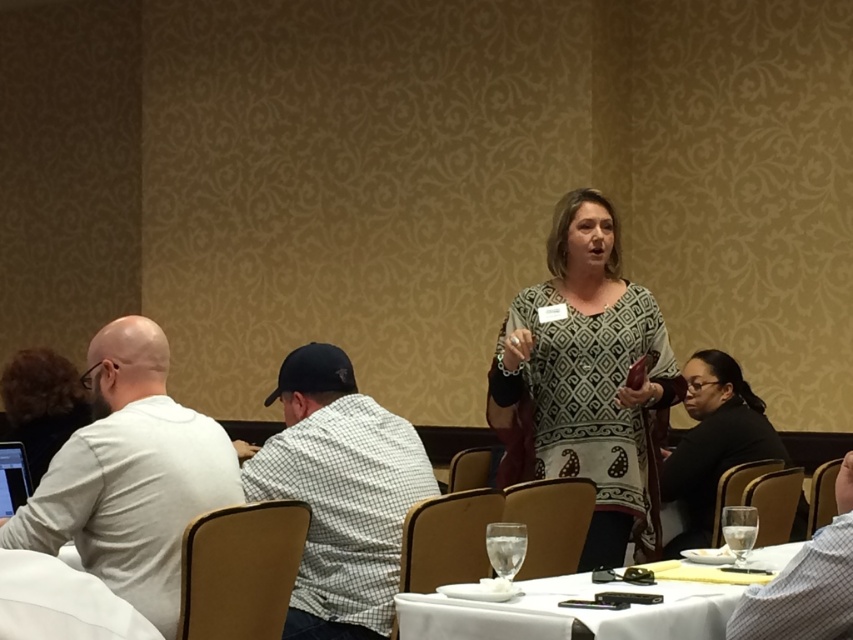
Who is positioned more to the right, patterned fabric shirt at center or clear glass at table right?

From the viewer's perspective, clear glass at table right appears more on the right side.

Who is higher up, patterned fabric shirt at center or clear glass at table right?

patterned fabric shirt at center is higher up.

The height and width of the screenshot is (640, 853). Find the location of `patterned fabric shirt at center`. patterned fabric shirt at center is located at coordinates (585, 381).

Does white cloth table at center appear under matte black shirt at center?

Yes, white cloth table at center is below matte black shirt at center.

Is white cloth table at center bigger than matte black shirt at center?

No.

The image size is (853, 640). Describe the element at coordinates (572, 612) in the screenshot. I see `white cloth table at center` at that location.

Image resolution: width=853 pixels, height=640 pixels. What are the coordinates of `white cloth table at center` in the screenshot? It's located at (572, 612).

Is white checkered shirt at lower right to the left of clear glass at table right from the viewer's perspective?

No, white checkered shirt at lower right is not to the left of clear glass at table right.

What are the coordinates of `white checkered shirt at lower right` in the screenshot? It's located at (805, 582).